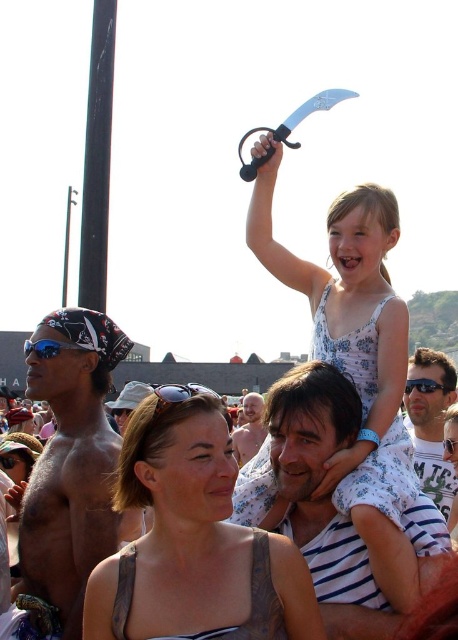
Which of these two, matte black tank top at center or white striped shirt at upper center, stands taller?

white striped shirt at upper center

Looking at this image, who is more distant from viewer, (262,534) or (278,435)?

The point (278,435) is more distant.

The image size is (458, 640). I want to click on matte black tank top at center, so click(x=194, y=544).

Which is below, matte black tank top at center or bald head at center?

bald head at center is below.

Who is taller, matte black tank top at center or bald head at center?

Standing taller between the two is matte black tank top at center.

Who is more distant from viewer, [281,592] or [254,429]?

Positioned behind is point [254,429].

This screenshot has width=458, height=640. I want to click on matte black tank top at center, so click(194, 544).

Can you confirm if shiny metallic bandana at left is positioned to the left of blue reflective lens at left?

In fact, shiny metallic bandana at left is to the right of blue reflective lens at left.

The image size is (458, 640). What are the coordinates of `shiny metallic bandana at left` in the screenshot? It's located at (70, 476).